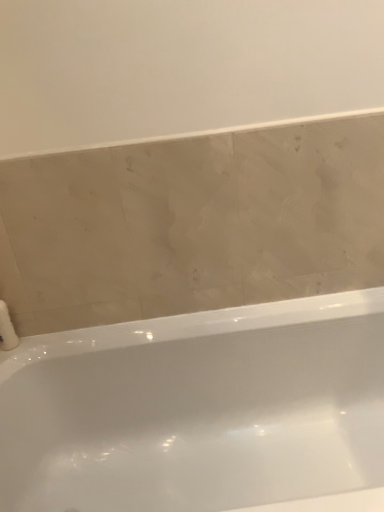
Question: Is white fluffy toilet paper at lower left taller or shorter than white glossy bathtub at center?

Choices:
 (A) short
 (B) tall

Answer: (A)

Question: From the image's perspective, is white fluffy toilet paper at lower left positioned above or below white glossy bathtub at center?

Choices:
 (A) below
 (B) above

Answer: (B)

Question: Is point (x=0, y=323) closer or farther from the camera than point (x=274, y=442)?

Choices:
 (A) farther
 (B) closer

Answer: (B)

Question: From the image's perspective, is white glossy bathtub at center located above or below white fluffy toilet paper at lower left?

Choices:
 (A) below
 (B) above

Answer: (A)

Question: Considering the positions of point (165, 330) and point (1, 312), is point (165, 330) closer or farther from the camera than point (1, 312)?

Choices:
 (A) closer
 (B) farther

Answer: (B)

Question: From their relative heights in the image, would you say white glossy bathtub at center is taller or shorter than white fluffy toilet paper at lower left?

Choices:
 (A) short
 (B) tall

Answer: (B)

Question: Would you say white glossy bathtub at center is inside or outside white fluffy toilet paper at lower left?

Choices:
 (A) outside
 (B) inside

Answer: (A)